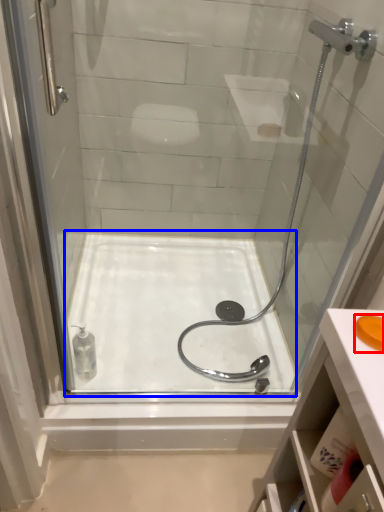
Question: Which of the following is the farthest to the observer, soap (highlighted by a red box) or bath (highlighted by a blue box)?

Choices:
 (A) soap
 (B) bath

Answer: (B)